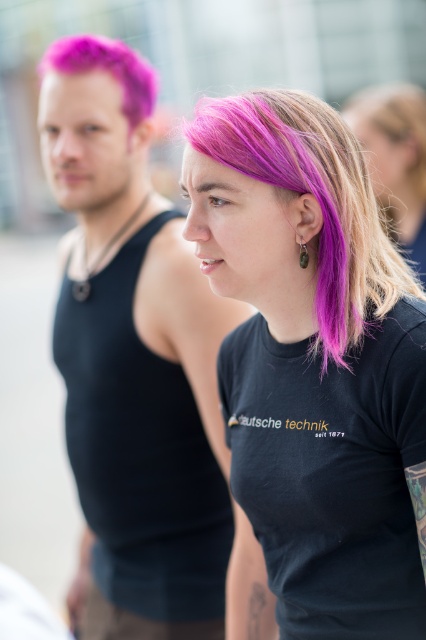
Question: Which point appears farthest from the camera in this image?

Choices:
 (A) tap(97, 60)
 (B) tap(416, 211)

Answer: (B)

Question: Can you confirm if matte black t-shirt at center is thinner than green stone pendant at ear?

Choices:
 (A) yes
 (B) no

Answer: (B)

Question: Is purple hair at center further to the viewer compared to purple matte hair at left?

Choices:
 (A) yes
 (B) no

Answer: (A)

Question: Can you confirm if matte black t-shirt at center is positioned to the left of purple matte hair at left?

Choices:
 (A) no
 (B) yes

Answer: (A)

Question: Which point is closer to the camera taking this photo?

Choices:
 (A) (414, 316)
 (B) (305, 246)
 (C) (81, 68)

Answer: (A)

Question: Which of the following is the closest to the observer?

Choices:
 (A) matte black tank top at left
 (B) green stone pendant at ear

Answer: (B)